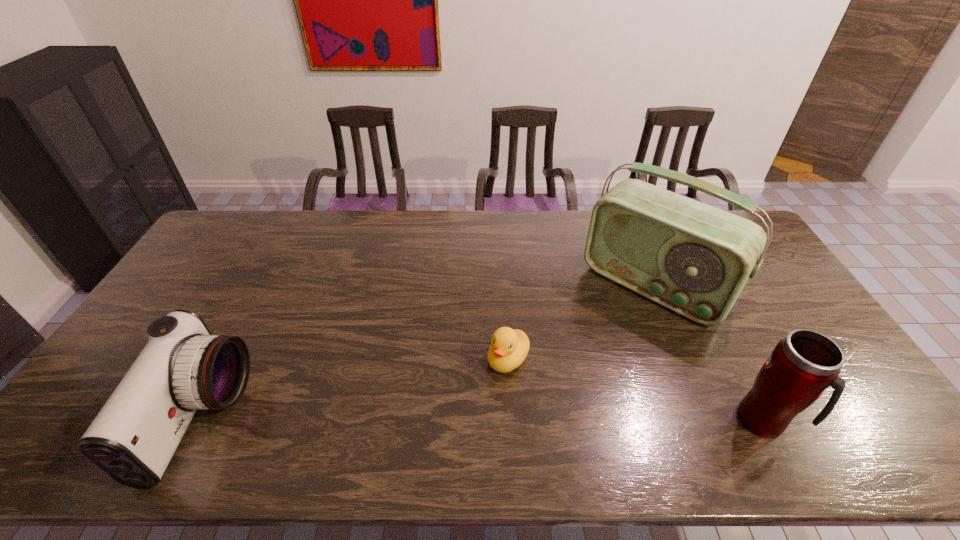
This screenshot has height=540, width=960. What are the coordinates of `free spot between the leftmost object and the second object from left to right` in the screenshot? It's located at (354, 389).

The image size is (960, 540). Find the location of `free space between the leftmost object and the shortest object`. free space between the leftmost object and the shortest object is located at coordinates (354, 389).

Where is `vacant point located between the tallest object and the camcorder`? This screenshot has height=540, width=960. vacant point located between the tallest object and the camcorder is located at coordinates (427, 352).

I want to click on vacant area that lies between the camcorder and the thermos bottle, so click(483, 420).

Find the location of a particular element. vacant region between the camcorder and the farthest object is located at coordinates click(x=427, y=352).

The height and width of the screenshot is (540, 960). Find the location of `vacant area that lies between the duckling and the second tallest object`. vacant area that lies between the duckling and the second tallest object is located at coordinates click(636, 390).

Identify the location of unoccupied position between the third shortest object and the tallest object. (708, 353).

I want to click on vacant area that lies between the third object from right to left and the thermos bottle, so [x=636, y=390].

The width and height of the screenshot is (960, 540). I want to click on vacant space that's between the third shortest object and the radio receiver, so click(x=708, y=353).

Locate an element on the screen. Image resolution: width=960 pixels, height=540 pixels. blank region between the thermos bottle and the radio receiver is located at coordinates tap(708, 353).